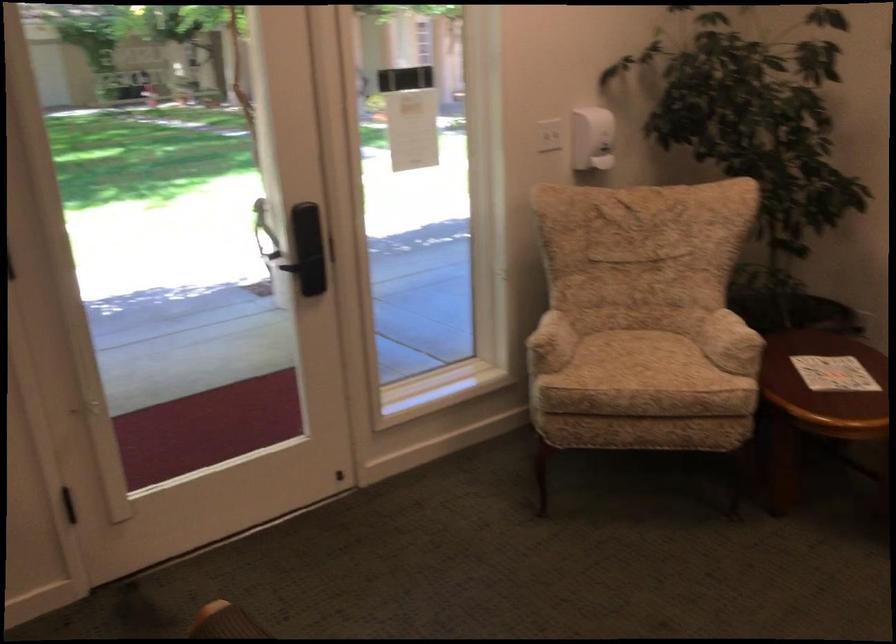
The image size is (896, 644). I want to click on chair sitting surface, so click(631, 346).